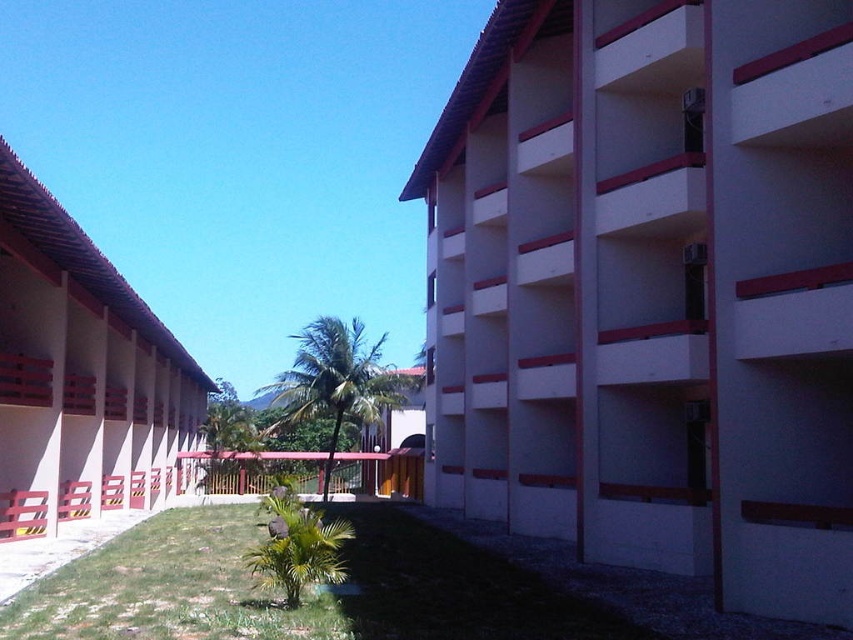
You are standing at the pathway between the buildings and want to take a photo of the white smooth building at center and the beige concrete building at left. Which building should you look upwards to capture in your photo?

You should look upwards to capture the white smooth building at center because it is located above the beige concrete building at left.

You are standing on the pathway between the white smooth building at center and the beige concrete building at left. You want to walk to the palm tree in the central area. Which building should you move away from to reach the palm tree?

The palm tree is located in the central area between the buildings. Since the white smooth building at center is closer to the central area than the beige concrete building at left, you should move away from the beige concrete building at left to reach the palm tree.